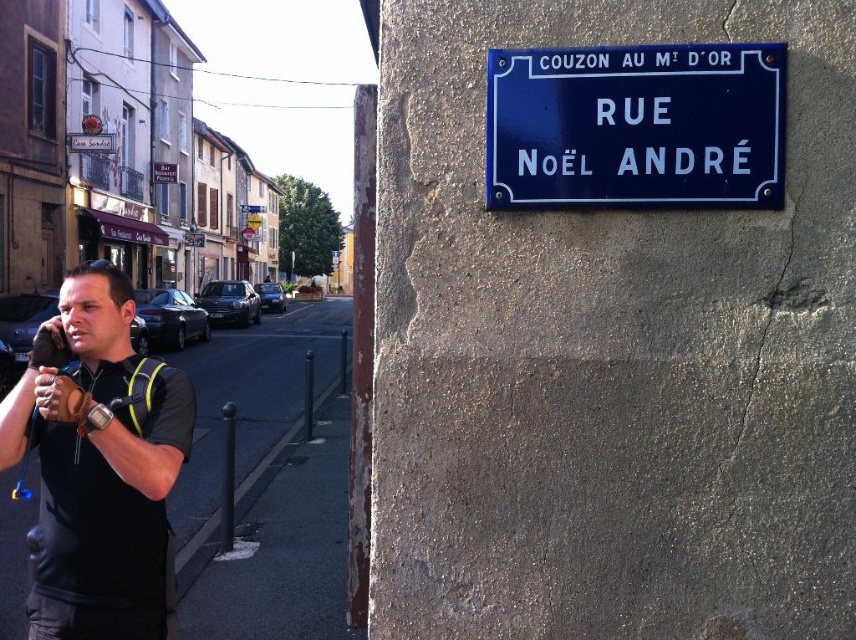
Question: Which object appears farthest from the camera in this image?

Choices:
 (A) black fabric shirt at left
 (B) blue enameled sign at upper right

Answer: (A)

Question: Does black fabric shirt at left have a smaller size compared to blue enameled sign at upper right?

Choices:
 (A) yes
 (B) no

Answer: (B)

Question: Which of the following is the closest to the observer?

Choices:
 (A) (63, 360)
 (B) (704, 51)

Answer: (B)

Question: Where is black fabric shirt at left located in relation to blue enameled sign at upper right in the image?

Choices:
 (A) left
 (B) right

Answer: (A)

Question: Is black fabric shirt at left smaller than blue enameled sign at upper right?

Choices:
 (A) no
 (B) yes

Answer: (A)